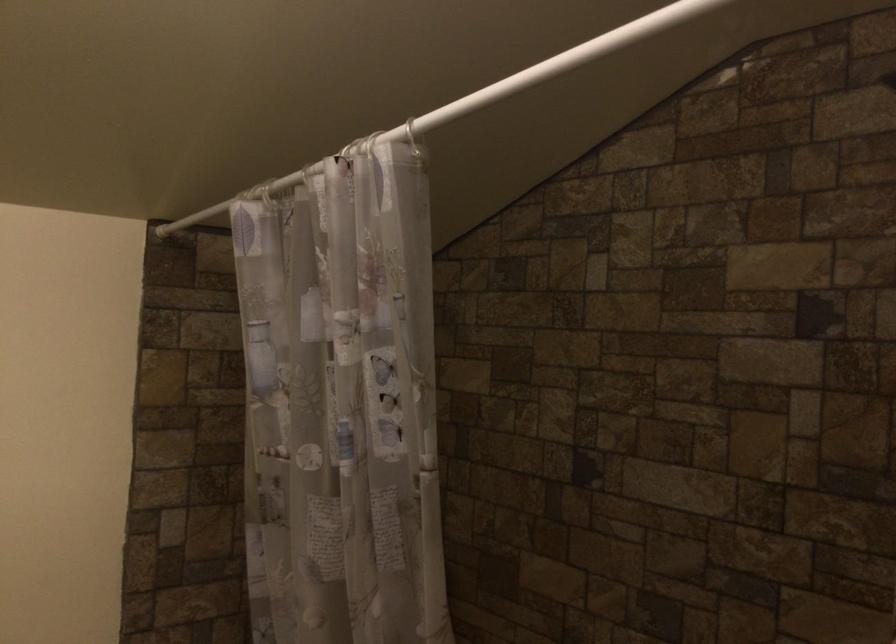
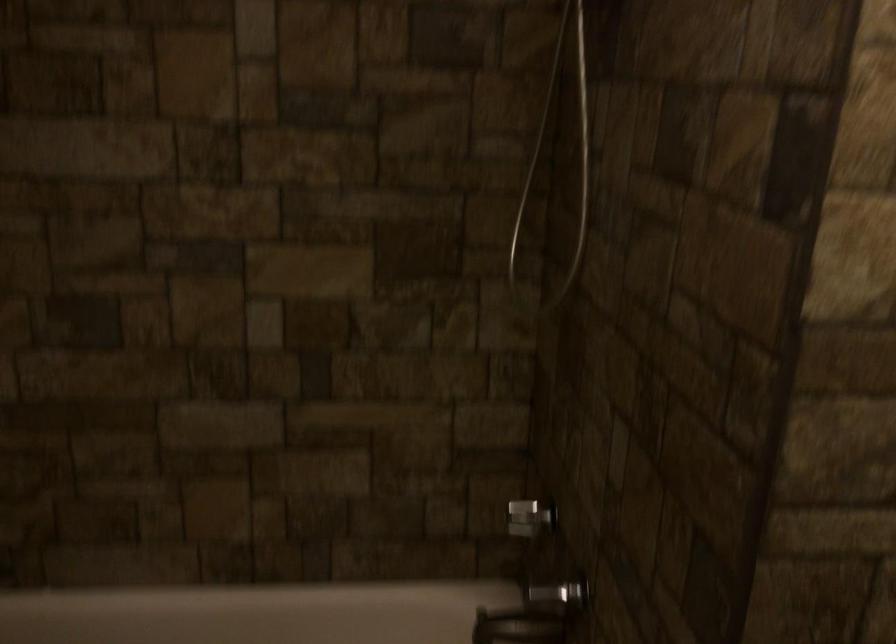
How did the camera likely rotate?

The camera rotated toward right-down.